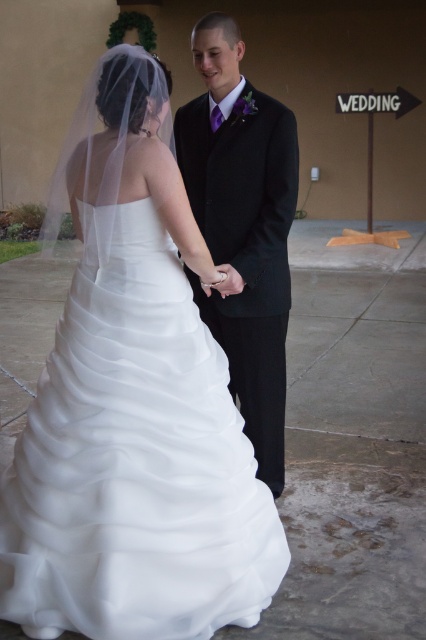
You are a photographer standing 5 feet away from the white satin dress at center and the black satin suit at center. You want to capture a photo where both outfits are in focus. Considering the distance between them, is it possible to adjust your camera settings to ensure both are sharp without moving the subjects?

The white satin dress at center and the black satin suit at center are 26.46 inches apart. At a distance of 5 feet, this separation allows for a sufficient depth of field to keep both in focus if the aperture is set appropriately. Therefore, adjusting the camera settings to a smaller aperture like f8 or higher should ensure both outfits are sharp without needing to move the subjects.

You are a photographer setting up for a wedding photo shoot. You have two main subjects wearing the white satin dress at center and the black satin suit at center. You need to position them so that both are clearly visible in the frame. Considering their sizes, which subject should be placed closer to the camera to ensure both appear balanced in the photo?

The white satin dress at center is larger in size than the black satin suit at center. To balance their appearance in the photo, the smaller black satin suit at center should be placed closer to the camera, while the larger white satin dress at center can be positioned slightly further back.